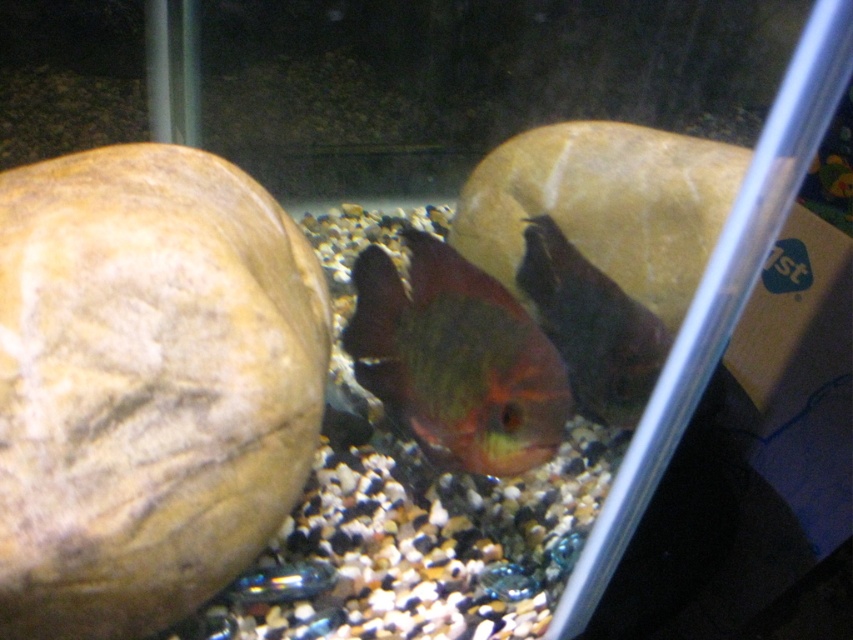
Is shiny greenish fish at center shorter than shiny metallic fish at center?

Indeed, shiny greenish fish at center has a lesser height compared to shiny metallic fish at center.

Who is taller, shiny greenish fish at center or shiny metallic fish at center?

shiny metallic fish at center

Between point (392, 413) and point (534, 240), which one is positioned in front?

Point (392, 413) is more forward.

The height and width of the screenshot is (640, 853). Find the location of `shiny greenish fish at center`. shiny greenish fish at center is located at coordinates (456, 360).